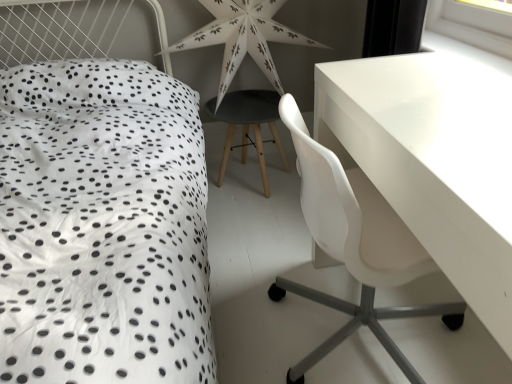
Question: From the image's perspective, would you say white plastic chair at right is shown under white paper star at center?

Choices:
 (A) no
 (B) yes

Answer: (B)

Question: Is white plastic chair at right facing towards white paper star at center?

Choices:
 (A) no
 (B) yes

Answer: (A)

Question: Does white plastic chair at right have a greater width compared to white paper star at center?

Choices:
 (A) yes
 (B) no

Answer: (A)

Question: Can white paper star at center be found inside white plastic chair at right?

Choices:
 (A) no
 (B) yes

Answer: (A)

Question: From the image's perspective, does white plastic chair at right appear higher than white paper star at center?

Choices:
 (A) yes
 (B) no

Answer: (B)

Question: From the image's perspective, is white plastic chair at right above or below white paper star at center?

Choices:
 (A) above
 (B) below

Answer: (B)

Question: From a real-world perspective, is white plastic chair at right positioned above or below white paper star at center?

Choices:
 (A) above
 (B) below

Answer: (B)

Question: Considering the positions of white plastic chair at right and white paper star at center in the image, is white plastic chair at right wider or thinner than white paper star at center?

Choices:
 (A) thin
 (B) wide

Answer: (B)

Question: Is point (305, 292) positioned closer to the camera than point (267, 69)?

Choices:
 (A) closer
 (B) farther

Answer: (A)

Question: In the image, is matte black stool at center on the left side or the right side of white paper star at center?

Choices:
 (A) right
 (B) left

Answer: (B)

Question: In terms of height, does matte black stool at center look taller or shorter compared to white paper star at center?

Choices:
 (A) tall
 (B) short

Answer: (B)

Question: From a real-world perspective, is matte black stool at center above or below white paper star at center?

Choices:
 (A) above
 (B) below

Answer: (B)

Question: Relative to white paper star at center, is matte black stool at center in front or behind?

Choices:
 (A) behind
 (B) front

Answer: (A)

Question: In the image, is matte black stool at center positioned in front of or behind white plastic chair at right?

Choices:
 (A) behind
 (B) front

Answer: (A)

Question: From the image's perspective, is matte black stool at center positioned above or below white plastic chair at right?

Choices:
 (A) above
 (B) below

Answer: (A)